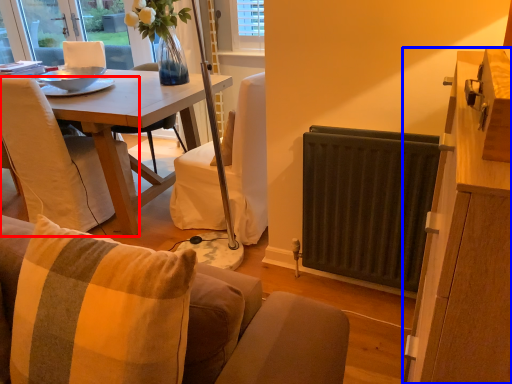
Question: Which of the following is the farthest to the observer, chair (highlighted by a red box) or cabinetry (highlighted by a blue box)?

Choices:
 (A) chair
 (B) cabinetry

Answer: (A)